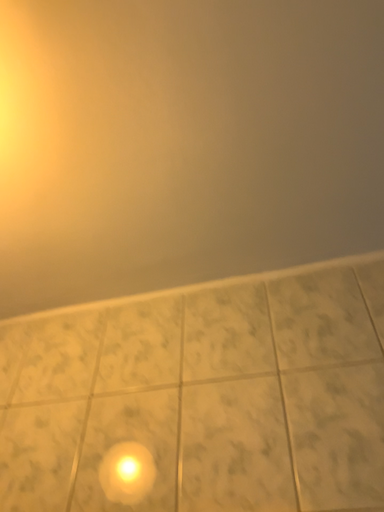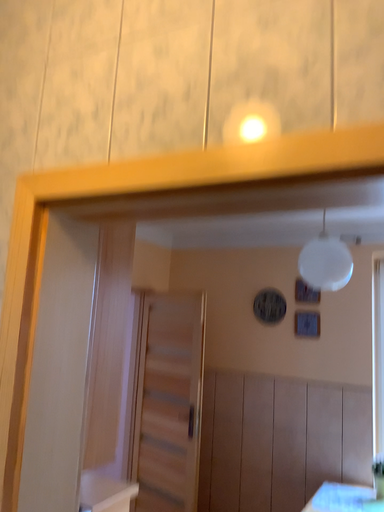
Question: Which way did the camera rotate in the video?

Choices:
 (A) rotated left
 (B) rotated right

Answer: (A)